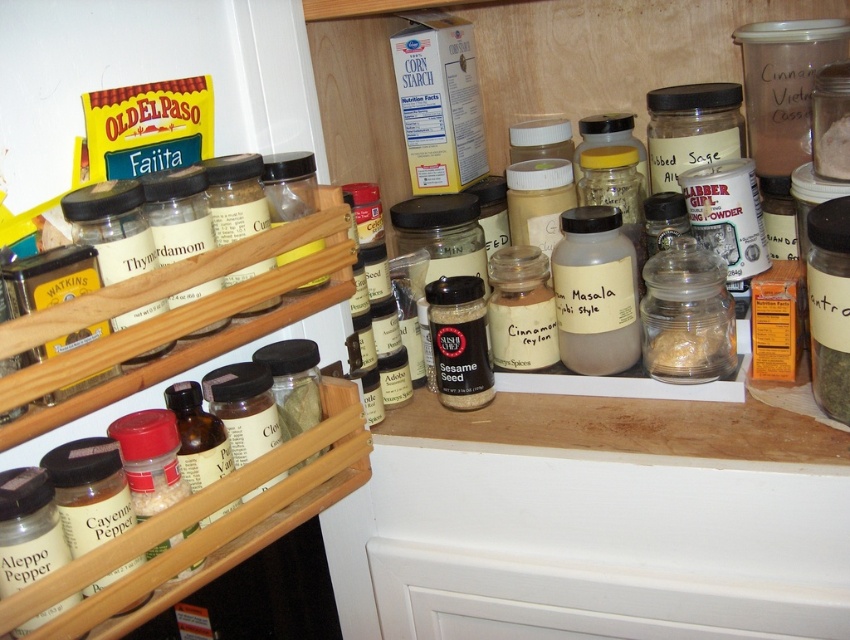
Based on the photo, is clear glass jar at center-right closer to the viewer compared to translucent glass jar at center-right?

Yes, it is.

Does point (684, 371) lie behind point (706, 355)?

Yes, it is behind point (706, 355).

Where is `clear glass jar at center-right`? clear glass jar at center-right is located at coordinates (686, 314).

Between translucent glass jars at center and clear plastic spice rack at left, which one is positioned lower?

clear plastic spice rack at left is below.

From the picture: Does translucent glass jars at center have a larger size compared to clear plastic spice rack at left?

Correct, translucent glass jars at center is larger in size than clear plastic spice rack at left.

Between point (489, 140) and point (37, 324), which one is positioned in front?

Point (37, 324) is more forward.

Where is `translucent glass jars at center`? translucent glass jars at center is located at coordinates (520, 64).

Is point (352, 428) positioned in front of point (717, 358)?

Yes, point (352, 428) is in front of point (717, 358).

Is clear plastic spice rack at left taller than translucent glass jar at center-right?

Correct, clear plastic spice rack at left is much taller as translucent glass jar at center-right.

Between point (202, 513) and point (717, 324), which one is positioned behind?

The point (717, 324) is behind.

Locate an element on the screen. clear plastic spice rack at left is located at coordinates (177, 316).